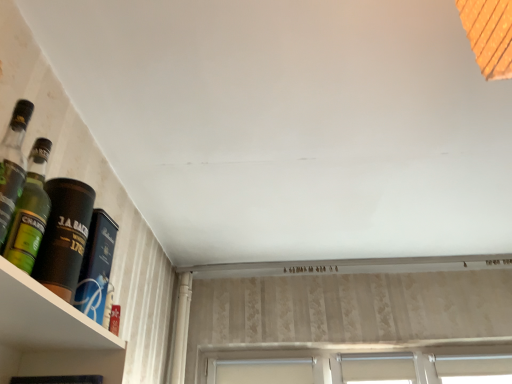
Question: Is white fabric window at lower center, the second window viewed from the right, shorter than white fabric window at lower right, which is the third window in left-to-right order?

Choices:
 (A) no
 (B) yes

Answer: (A)

Question: From the image's perspective, is white fabric window at lower center, the second window viewed from the right, beneath white fabric window at lower right, which appears as the 1th window when viewed from the right?

Choices:
 (A) yes
 (B) no

Answer: (B)

Question: Does white fabric window at lower center, the second window viewed from the right, come behind white fabric window at lower right, which appears as the 1th window when viewed from the right?

Choices:
 (A) no
 (B) yes

Answer: (A)

Question: Is white fabric window at lower center, the second window viewed from the right, closer to camera compared to white fabric window at lower right, which is the third window in left-to-right order?

Choices:
 (A) no
 (B) yes

Answer: (B)

Question: From a real-world perspective, is white fabric window at lower center, which is the second window in left-to-right order, over white fabric window at lower right, which is the third window in left-to-right order?

Choices:
 (A) no
 (B) yes

Answer: (A)

Question: Would you say green glass bottle at left, marked as the 3th bottle in a back-to-front arrangement, is inside or outside white fabric window at lower center, which is the second window in left-to-right order?

Choices:
 (A) outside
 (B) inside

Answer: (A)

Question: From a real-world perspective, is green glass bottle at left, marked as the 3th bottle in a back-to-front arrangement, positioned above or below white fabric window at lower center, which is the second window in left-to-right order?

Choices:
 (A) below
 (B) above

Answer: (A)

Question: Is green glass bottle at left, marked as the 3th bottle in a back-to-front arrangement, in front of or behind white fabric window at lower center, the second window viewed from the right, in the image?

Choices:
 (A) behind
 (B) front

Answer: (B)

Question: Considering the positions of green glass bottle at left, marked as the 3th bottle in a back-to-front arrangement, and white fabric window at lower center, the second window viewed from the right, in the image, is green glass bottle at left, marked as the 3th bottle in a back-to-front arrangement, wider or thinner than white fabric window at lower center, the second window viewed from the right,?

Choices:
 (A) thin
 (B) wide

Answer: (B)

Question: From the image's perspective, is white plastic window at center, marked as the first window in a left-to-right arrangement, above or below white fabric window at lower right, which is the third window in left-to-right order?

Choices:
 (A) below
 (B) above

Answer: (A)

Question: Looking at the image, does white plastic window at center, which ranks as the 3th window in right-to-left order, seem bigger or smaller compared to white fabric window at lower right, which is the third window in left-to-right order?

Choices:
 (A) big
 (B) small

Answer: (A)

Question: Is white plastic window at center, which ranks as the 3th window in right-to-left order, taller or shorter than white fabric window at lower right, which is the third window in left-to-right order?

Choices:
 (A) short
 (B) tall

Answer: (B)

Question: Looking at their shapes, would you say white plastic window at center, which ranks as the 3th window in right-to-left order, is wider or thinner than white fabric window at lower right, which appears as the 1th window when viewed from the right?

Choices:
 (A) wide
 (B) thin

Answer: (B)

Question: From the image's perspective, relative to green glass bottle at left, marked as the 3th bottle in a back-to-front arrangement, is white fabric window at lower right, which appears as the 1th window when viewed from the right, above or below?

Choices:
 (A) above
 (B) below

Answer: (B)

Question: In the image, is white fabric window at lower right, which is the third window in left-to-right order, positioned in front of or behind green glass bottle at left, positioned as the 1th bottle in front-to-back order?

Choices:
 (A) front
 (B) behind

Answer: (B)